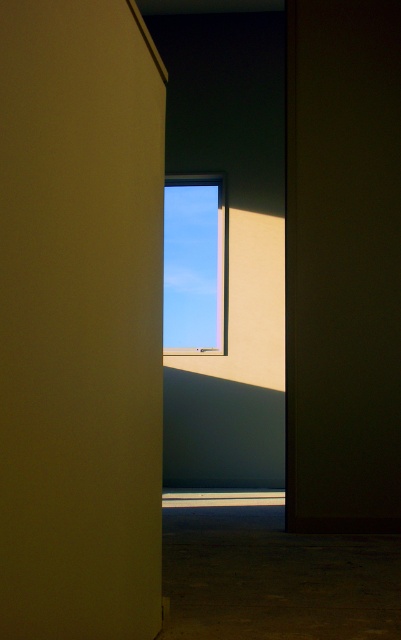
Is matte yellow door at center positioned before transparent glass window at center?

Yes, matte yellow door at center is closer to the viewer.

Who is higher up, matte yellow door at center or transparent glass window at center?

Positioned higher is transparent glass window at center.

Between point (99, 468) and point (220, 218), which one is positioned behind?

Positioned behind is point (220, 218).

Locate an element on the screen. The height and width of the screenshot is (640, 401). matte yellow door at center is located at coordinates (81, 321).